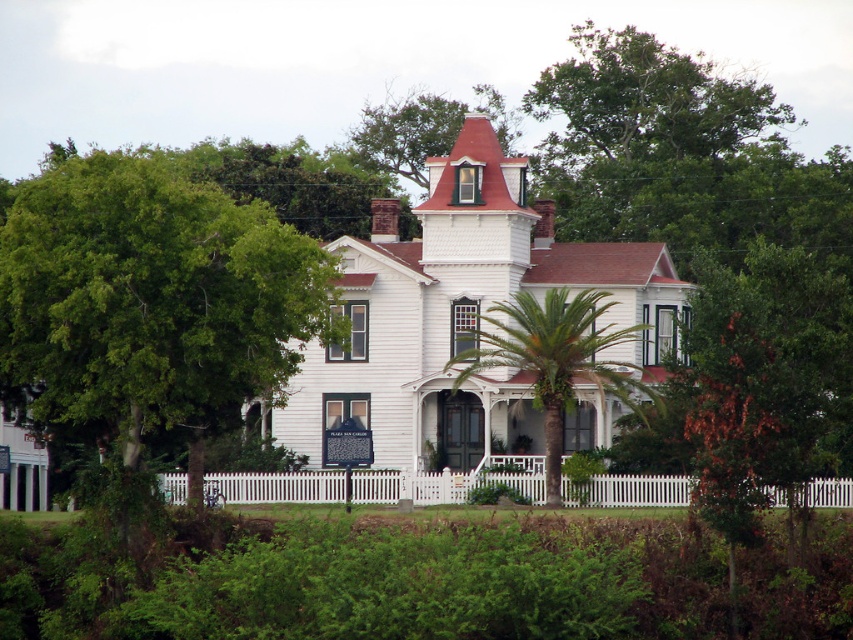
Is green leafy tree at lower left above green leafy palm tree at center?

Yes, green leafy tree at lower left is above green leafy palm tree at center.

Is the position of green leafy tree at lower left more distant than that of green leafy palm tree at center?

No, green leafy tree at lower left is closer to the viewer.

This screenshot has width=853, height=640. Describe the element at coordinates (149, 301) in the screenshot. I see `green leafy tree at lower left` at that location.

This screenshot has height=640, width=853. Find the location of `green leafy tree at lower left`. green leafy tree at lower left is located at coordinates (149, 301).